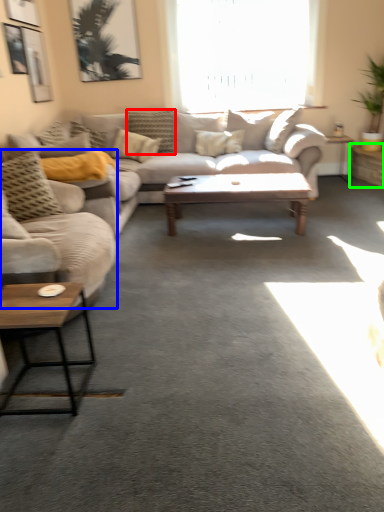
Question: Which is nearer to the pillow (highlighted by a red box)? studio couch (highlighted by a blue box) or table (highlighted by a green box).

Choices:
 (A) studio couch
 (B) table

Answer: (B)